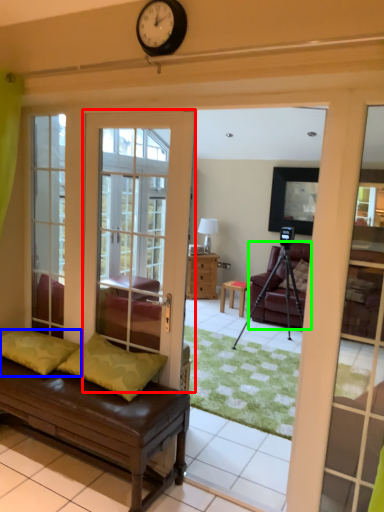
Question: Estimate the real-world distances between objects in this image. Which object is farther from door (highlighted by a red box), pillow (highlighted by a blue box) or chair (highlighted by a green box)?

Choices:
 (A) pillow
 (B) chair

Answer: (B)